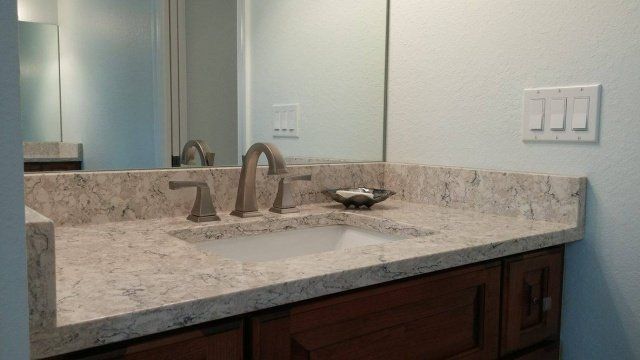
Locate an element on the screen. The height and width of the screenshot is (360, 640). sink is located at coordinates (294, 246).